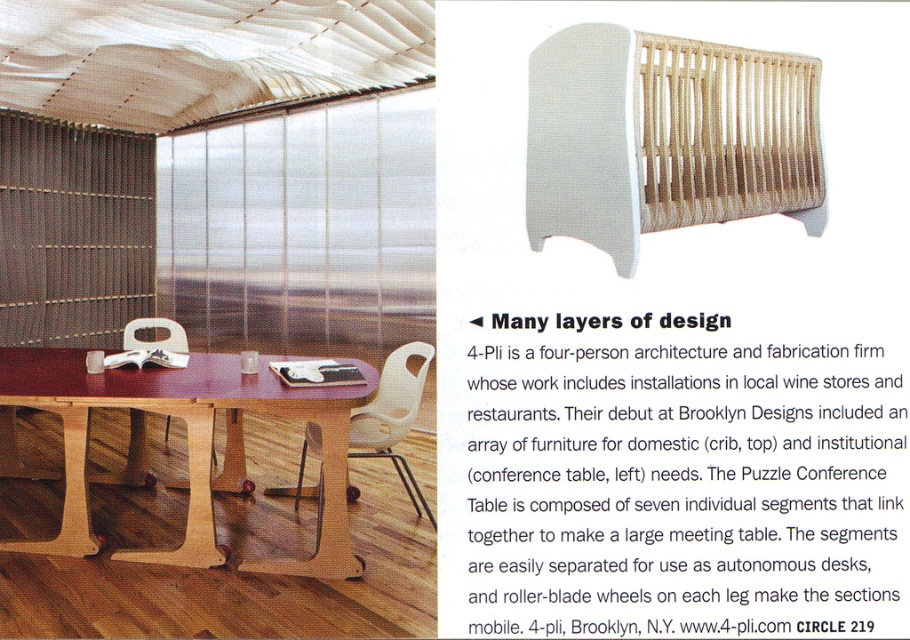
Question: In this image, where is natural wood crib at upper right located relative to mahogany wood conference table at center?

Choices:
 (A) above
 (B) below

Answer: (A)

Question: In this image, where is mahogany wood conference table at center located relative to white matte chair at center?

Choices:
 (A) right
 (B) left

Answer: (A)

Question: Which point is farther to the camera?

Choices:
 (A) mahogany wood conference table at center
 (B) white matte chair at center

Answer: (B)

Question: Estimate the real-world distances between objects in this image. Which object is farther from the white plastic chair at lower center?

Choices:
 (A) mahogany wood conference table at center
 (B) natural wood crib at upper right
 (C) white matte chair at center

Answer: (B)

Question: Is natural wood crib at upper right behind white matte chair at center?

Choices:
 (A) yes
 (B) no

Answer: (B)

Question: Which object appears farthest from the camera in this image?

Choices:
 (A) mahogany wood conference table at center
 (B) white matte chair at center

Answer: (B)